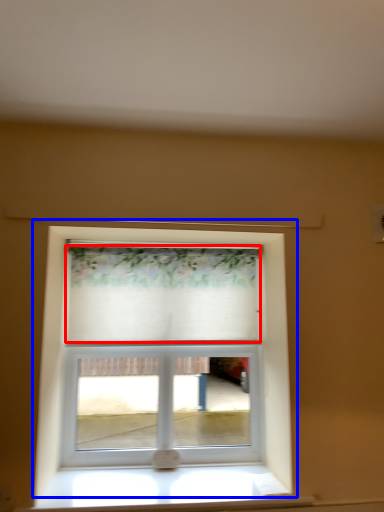
Question: Which object is closer to the camera taking this photo, curtain (highlighted by a red box) or window (highlighted by a blue box)?

Choices:
 (A) curtain
 (B) window

Answer: (A)